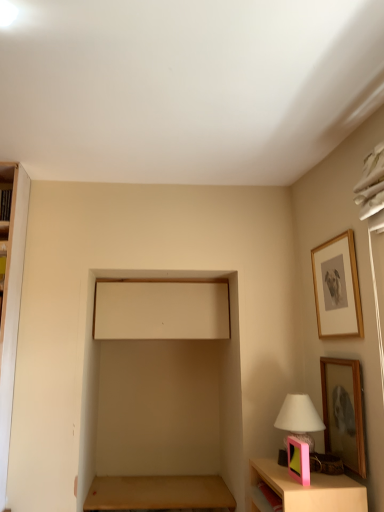
This screenshot has width=384, height=512. In order to click on blank area beneath white matte window screen at center (from a real-world perspective) in this screenshot , I will do `click(177, 486)`.